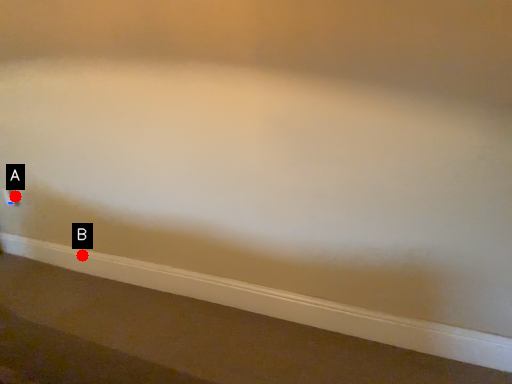
Question: Two points are circled on the image, labeled by A and B beside each circle. Which of the following is the closest to the observer?

Choices:
 (A) A is closer
 (B) B is closer

Answer: (B)